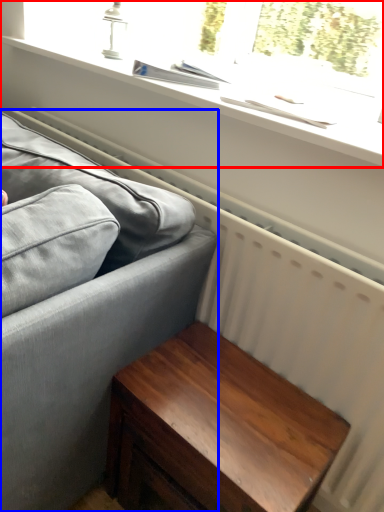
Question: Which point is closer to the camera, window (highlighted by a red box) or studio couch (highlighted by a blue box)?

Choices:
 (A) window
 (B) studio couch

Answer: (B)